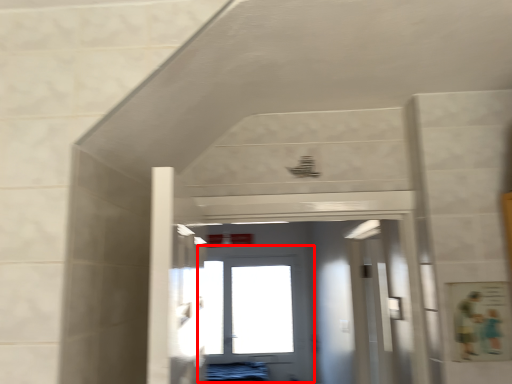
Question: Where is door (annotated by the red box) located in relation to door in the image?

Choices:
 (A) right
 (B) left

Answer: (B)